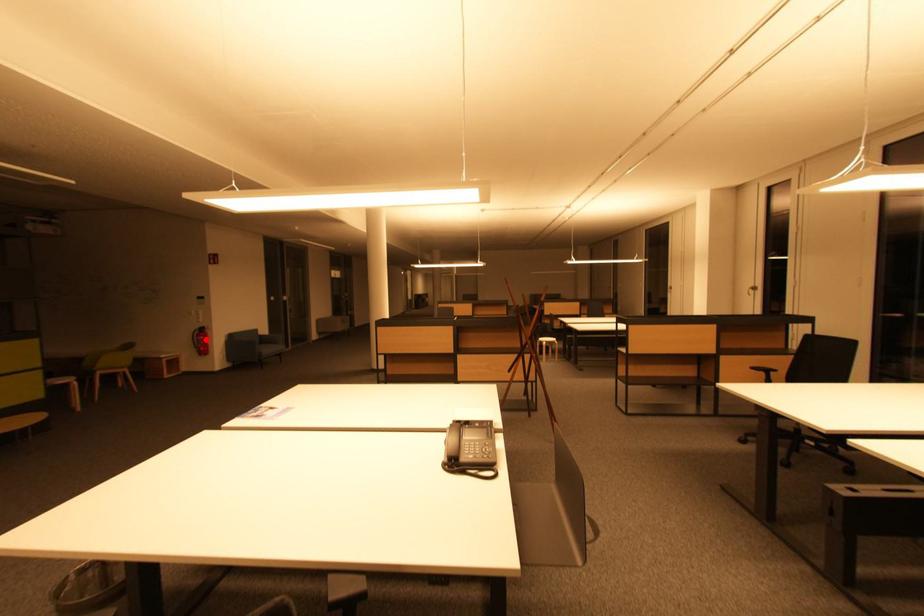
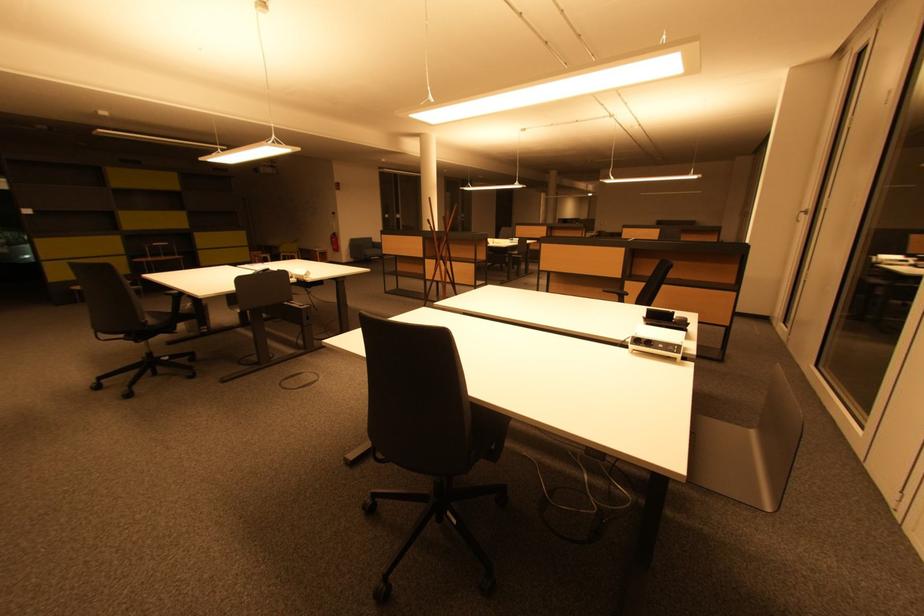
In the second image, find the point that corresponds to the highlighted location in the first image.

(338, 241)